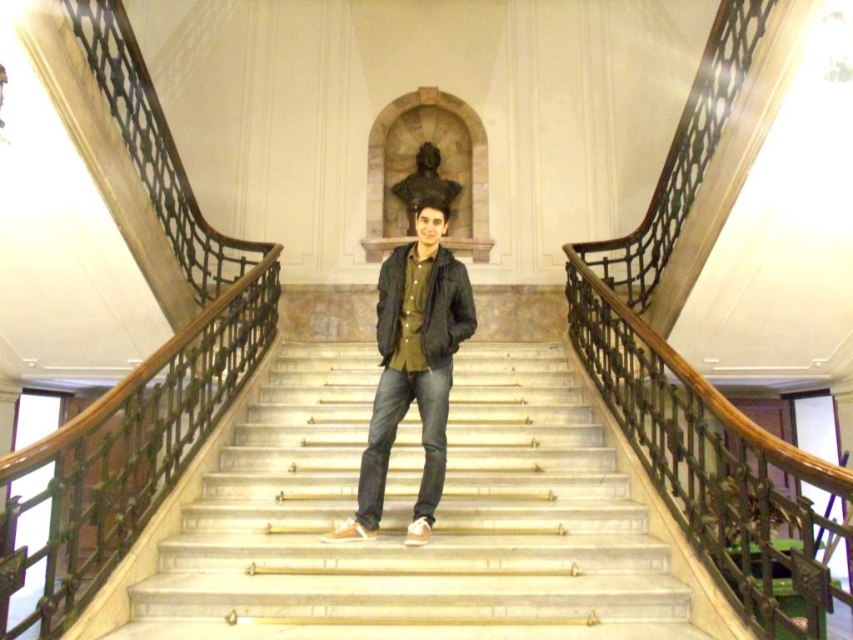
Question: Does dark green fabric jacket at center appear on the left side of dark green matte jacket at center?

Choices:
 (A) yes
 (B) no

Answer: (A)

Question: Estimate the real-world distances between objects in this image. Which object is farther from the dark green matte jacket at center?

Choices:
 (A) white marble stairs at center
 (B) dark green fabric jacket at center

Answer: (A)

Question: Which is nearer to the white marble stairs at center?

Choices:
 (A) dark green fabric jacket at center
 (B) dark green matte jacket at center

Answer: (A)

Question: Is white marble stairs at center below dark green fabric jacket at center?

Choices:
 (A) yes
 (B) no

Answer: (A)

Question: Can you confirm if white marble stairs at center is wider than dark green fabric jacket at center?

Choices:
 (A) yes
 (B) no

Answer: (A)

Question: Which of the following is the farthest from the observer?

Choices:
 (A) (347, 588)
 (B) (409, 266)

Answer: (B)